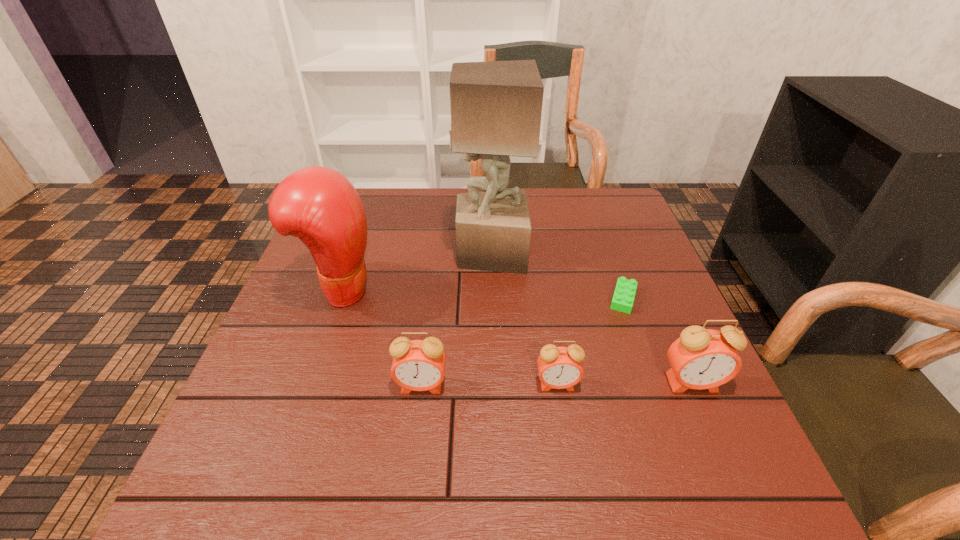
Considering the uniform spacing of alarm clocks, where should an additional alarm clock be positioned on the left? Please locate a free spot. Please provide its 2D coordinates. Your answer should be formatted as a tuple, i.e. [(x, y)], where the tuple contains the x and y coordinates of a point satisfying the conditions above.

[(285, 387)]